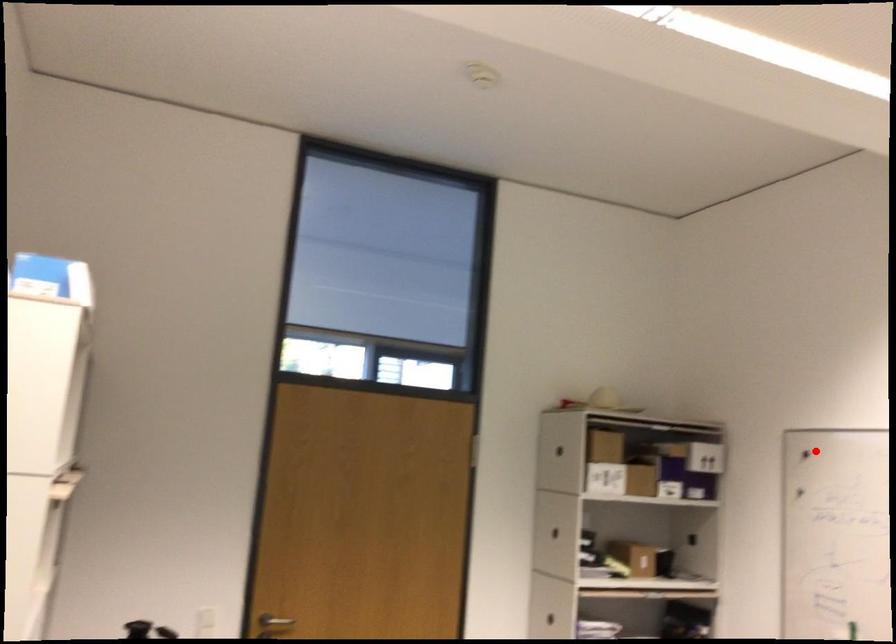
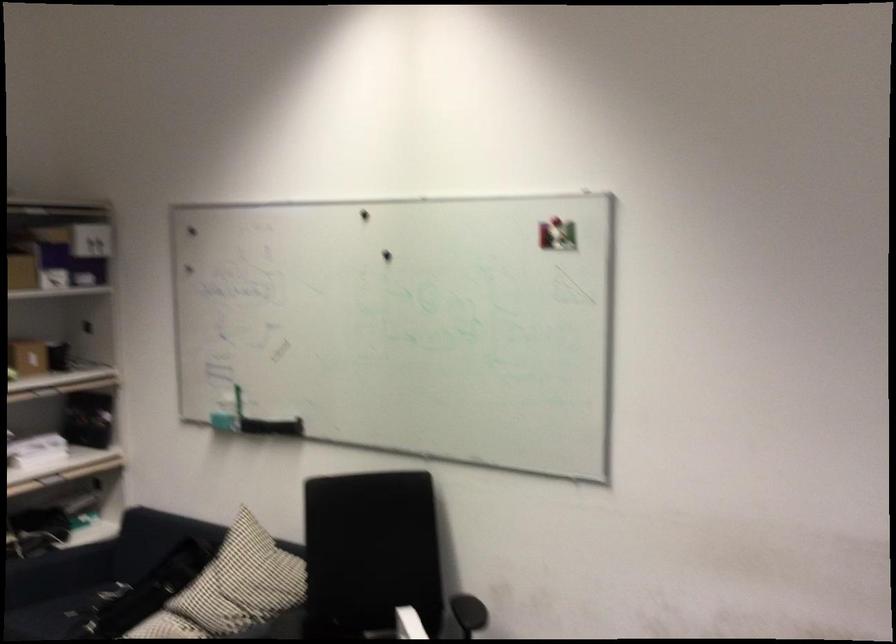
The point at the highlighted location is marked in the first image. Where is the corresponding point in the second image?

(192, 231)